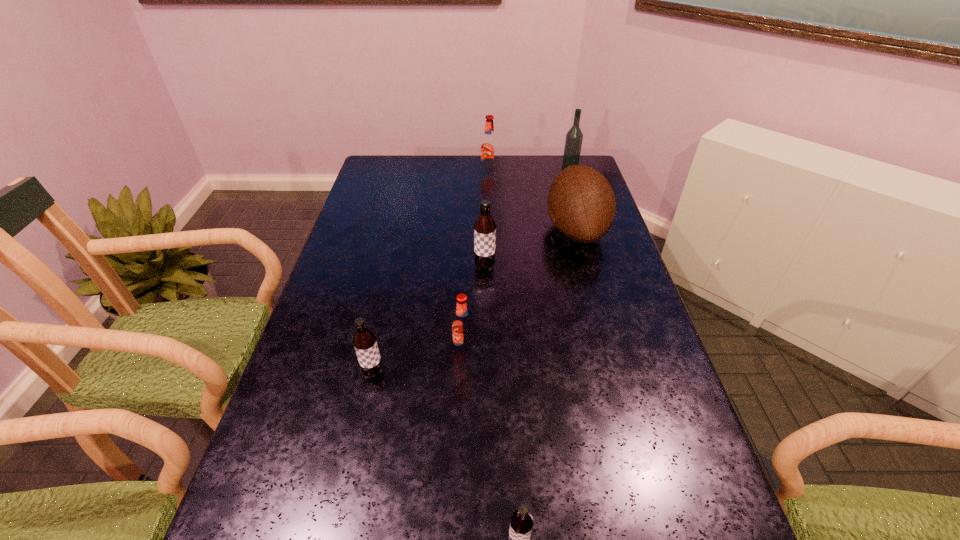
I want to click on vacant point located between the left red root beer and the biggest brown root beer, so click(x=474, y=309).

Image resolution: width=960 pixels, height=540 pixels. Find the location of `free spot between the vodka and the third farthest root beer`. free spot between the vodka and the third farthest root beer is located at coordinates (516, 259).

The image size is (960, 540). Identify the location of free space between the brown football and the second brown root beer from left to right. click(x=531, y=248).

Find the location of a particular element. This screenshot has width=960, height=540. the second closest object relative to the farthest root beer is located at coordinates (574, 137).

The width and height of the screenshot is (960, 540). What are the coordinates of `object that stands as the third closest to the bigger red root beer` in the screenshot? It's located at (484, 227).

What are the coordinates of `root beer that stands as the third closest to the nearer red root beer` in the screenshot? It's located at (521, 521).

Select which root beer appears as the closest to the smallest brown root beer. Please provide its 2D coordinates. Your answer should be formatted as a tuple, i.e. [(x, y)], where the tuple contains the x and y coordinates of a point satisfying the conditions above.

[(462, 326)]

The height and width of the screenshot is (540, 960). I want to click on the closest brown root beer to the black vodka, so click(484, 227).

In order to click on brown root beer that stands as the third closest to the football in this screenshot , I will do `click(521, 521)`.